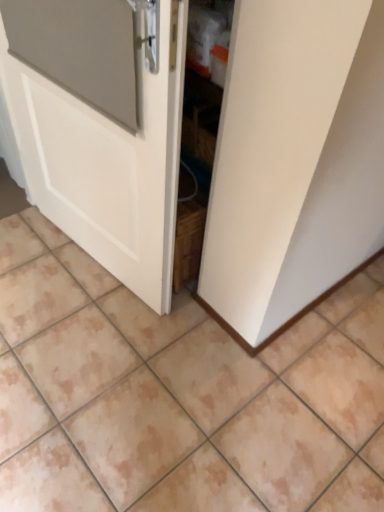
Where is `vacant area situated to the left side of white matte door at center`? Image resolution: width=384 pixels, height=512 pixels. vacant area situated to the left side of white matte door at center is located at coordinates (35, 253).